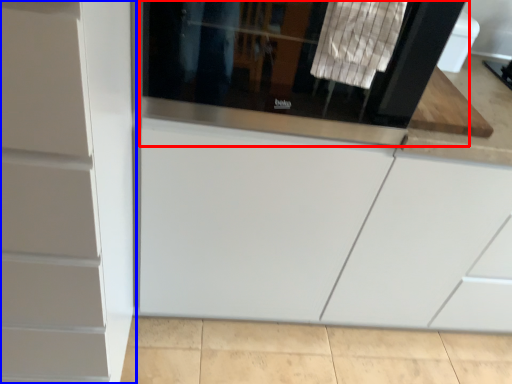
Question: Which object appears closest to the camera in this image, screen door (highlighted by a red box) or cabinetry (highlighted by a blue box)?

Choices:
 (A) screen door
 (B) cabinetry

Answer: (B)